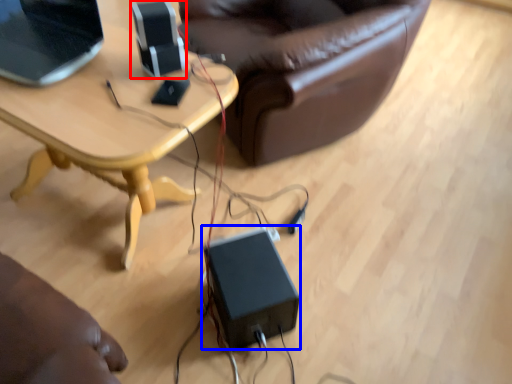
Question: Among these objects, which one is farthest to the camera, speaker (highlighted by a red box) or speaker (highlighted by a blue box)?

Choices:
 (A) speaker
 (B) speaker

Answer: (B)